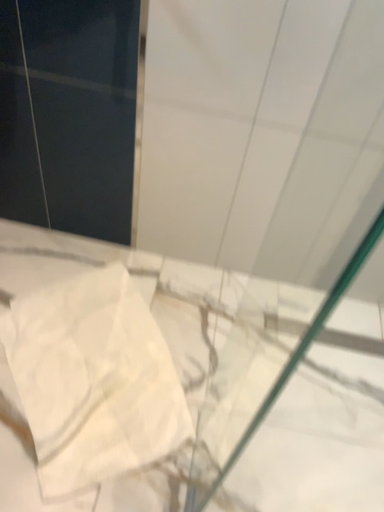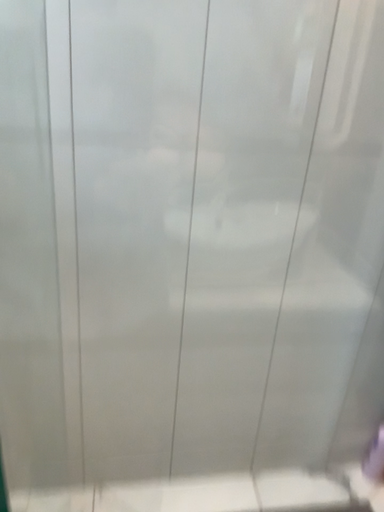
Question: Which way did the camera rotate in the video?

Choices:
 (A) rotated upward
 (B) rotated downward

Answer: (A)